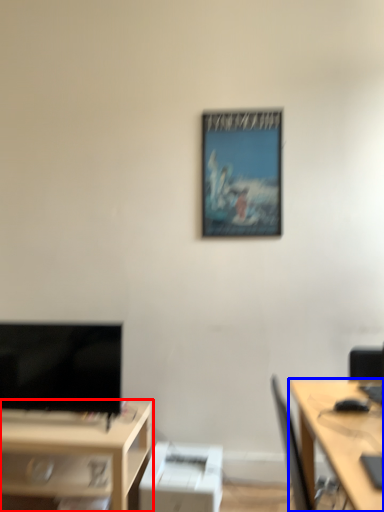
Question: Which object is closer to the camera taking this photo, desk (highlighted by a red box) or desk (highlighted by a blue box)?

Choices:
 (A) desk
 (B) desk

Answer: (B)